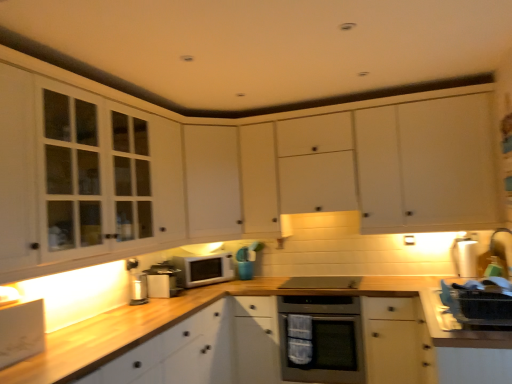
Question: Could you tell me if metallic silver canister at lower left, the 1th appliance in the left-to-right sequence, is facing white wood cabinet at lower left, positioned as the first cabinetry in bottom-to-top order?

Choices:
 (A) no
 (B) yes

Answer: (A)

Question: Is metallic silver canister at lower left, which appears as the fourth appliance when viewed from the right, located outside white wood cabinet at lower left, which appears as the 5th cabinetry when viewed from the top?

Choices:
 (A) no
 (B) yes

Answer: (B)

Question: Is metallic silver canister at lower left, which appears as the fourth appliance when viewed from the right, touching white wood cabinet at lower left, which appears as the 5th cabinetry when viewed from the top?

Choices:
 (A) yes
 (B) no

Answer: (B)

Question: From the image's perspective, is metallic silver canister at lower left, which appears as the fourth appliance when viewed from the right, on white wood cabinet at lower left, which appears as the 5th cabinetry when viewed from the top?

Choices:
 (A) no
 (B) yes

Answer: (B)

Question: From a real-world perspective, is metallic silver canister at lower left, which appears as the fourth appliance when viewed from the right, on white wood cabinet at lower left, positioned as the first cabinetry in bottom-to-top order?

Choices:
 (A) yes
 (B) no

Answer: (A)

Question: From a real-world perspective, is metallic silver canister at lower left, which appears as the fourth appliance when viewed from the right, positioned under white wood cabinet at lower left, positioned as the first cabinetry in bottom-to-top order, based on gravity?

Choices:
 (A) yes
 (B) no

Answer: (B)

Question: Does white matte cabinet at center, arranged as the 2th cabinetry when ordered from the bottom, appear on the right side of metallic silver toaster at center, the 3th appliance in the right-to-left sequence?

Choices:
 (A) yes
 (B) no

Answer: (A)

Question: Could you tell me if white matte cabinet at center, which ranks as the fourth cabinetry in top-to-bottom order, is turned towards metallic silver toaster at center, the 3th appliance in the right-to-left sequence?

Choices:
 (A) yes
 (B) no

Answer: (B)

Question: From the image's perspective, is white matte cabinet at center, which ranks as the fourth cabinetry in top-to-bottom order, located beneath metallic silver toaster at center, the 3th appliance in the right-to-left sequence?

Choices:
 (A) no
 (B) yes

Answer: (A)

Question: Can you confirm if white matte cabinet at center, which ranks as the fourth cabinetry in top-to-bottom order, is smaller than metallic silver toaster at center, the 3th appliance in the right-to-left sequence?

Choices:
 (A) no
 (B) yes

Answer: (A)

Question: Would you say metallic silver toaster at center, which is counted as the second appliance, starting from the left, is part of white matte cabinet at center, which ranks as the fourth cabinetry in top-to-bottom order,'s contents?

Choices:
 (A) yes
 (B) no

Answer: (B)

Question: Is white matte cabinet at center, arranged as the 2th cabinetry when ordered from the bottom, shorter than metallic silver toaster at center, the 3th appliance in the right-to-left sequence?

Choices:
 (A) yes
 (B) no

Answer: (B)

Question: Does white wood cabinet at lower left, which appears as the 5th cabinetry when viewed from the top, have a greater height compared to white glass-fronted cabinets at left, which is the third cabinetry from top to bottom?

Choices:
 (A) yes
 (B) no

Answer: (B)